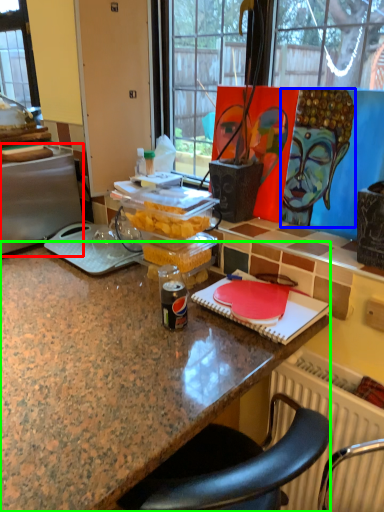
Question: Estimate the real-world distances between objects in this image. Which object is farther from appliance (highlighted by a red box), person (highlighted by a blue box) or desk (highlighted by a green box)?

Choices:
 (A) person
 (B) desk

Answer: (A)